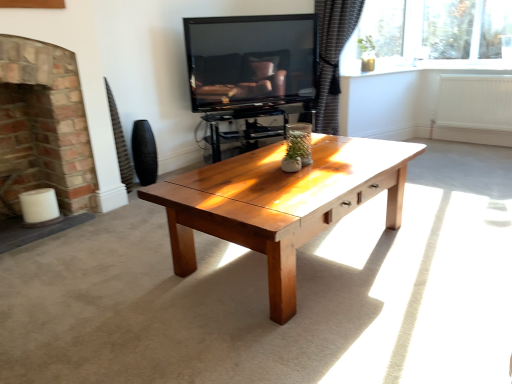
This screenshot has width=512, height=384. Identify the location of matte black tv at upper center. (250, 60).

What is the approximate width of matte black tv at upper center?

8.75 inches.

Measure the distance between point (x=322, y=23) and camera.

A distance of 3.81 meters exists between point (x=322, y=23) and camera.

The image size is (512, 384). What are the coordinates of `white painted radiator at right` in the screenshot? It's located at pos(475,102).

Considering the relative sizes of brick fireplace at left and white painted radiator at right in the image provided, is brick fireplace at left bigger than white painted radiator at right?

Yes.

Is brick fireplace at left aimed at white painted radiator at right?

No, brick fireplace at left does not turn towards white painted radiator at right.

How different are the orientations of brick fireplace at left and white painted radiator at right in degrees?

The facing directions of brick fireplace at left and white painted radiator at right are 89.8 degrees apart.

From the image's perspective, does brick fireplace at left appear lower than white painted radiator at right?

Yes, from the image's perspective, brick fireplace at left is beneath white painted radiator at right.

How many degrees apart are the facing directions of white painted radiator at right and matte black tv at upper center?

59.7 degrees.

Is white painted radiator at right directly adjacent to matte black tv at upper center?

white painted radiator at right is not next to matte black tv at upper center, and they're not touching.

From the image's perspective, is white painted radiator at right on top of matte black tv at upper center?

No.

In terms of height, does white painted radiator at right look taller or shorter compared to matte black tv at upper center?

Considering their sizes, white painted radiator at right has less height than matte black tv at upper center.

From the image's perspective, is white painted radiator at right positioned above or below dark textured curtain at upper right?

Clearly, from the image's perspective, white painted radiator at right is below dark textured curtain at upper right.

Looking at this image, measure the distance from white painted radiator at right to dark textured curtain at upper right.

4.20 feet.

Is white painted radiator at right situated inside dark textured curtain at upper right or outside?

white painted radiator at right exists outside the volume of dark textured curtain at upper right.

Which of these two, white painted radiator at right or dark textured curtain at upper right, stands taller?

dark textured curtain at upper right.

Does black matte vase at left lie in front of white painted radiator at right?

Yes, it is in front of white painted radiator at right.

Consider the image. Does black matte vase at left have a lesser height compared to white painted radiator at right?

Yes, black matte vase at left is shorter than white painted radiator at right.

Who is bigger, black matte vase at left or white painted radiator at right?

white painted radiator at right is bigger.

Is dark textured curtain at upper right positioned in front of matte black tv at upper center?

That is False.

Consider the image. Is dark textured curtain at upper right not near matte black tv at upper center?

No, dark textured curtain at upper right is not far from matte black tv at upper center.

From a real-world perspective, who is located higher, dark textured curtain at upper right or matte black tv at upper center?

From a 3D spatial view, matte black tv at upper center is above.

Between dark textured curtain at upper right and brick fireplace at left, which one appears on the left side from the viewer's perspective?

Positioned to the left is brick fireplace at left.

In the scene shown: Can we say dark textured curtain at upper right lies outside brick fireplace at left?

dark textured curtain at upper right lies outside brick fireplace at left's area.

This screenshot has width=512, height=384. Find the location of `fireplace that is on the left side of dark textured curtain at upper right`. fireplace that is on the left side of dark textured curtain at upper right is located at coordinates (42, 137).

Does dark textured curtain at upper right lie in front of brick fireplace at left?

That is False.

Does point (11, 177) come behind point (202, 36)?

That is False.

From the image's perspective, is brick fireplace at left positioned above or below matte black tv at upper center?

brick fireplace at left is situated lower than matte black tv at upper center in the image.

Is there a large distance between brick fireplace at left and matte black tv at upper center?

Yes, brick fireplace at left is far from matte black tv at upper center.

At what (x,y) coordinates should I click in order to perform the action: click on fireplace located in front of the white painted radiator at right. Please return your answer as a coordinate pair (x, y). Image resolution: width=512 pixels, height=384 pixels. Looking at the image, I should click on (42, 137).

Locate an element on the screen. The height and width of the screenshot is (384, 512). radiator below the matte black tv at upper center (from a real-world perspective) is located at coordinates (475, 102).

From the image, which object appears to be farther from black matte vase at left, dark textured curtain at upper right or white painted radiator at right?

Based on the image, white painted radiator at right appears to be further to black matte vase at left.

When comparing their distances from brick fireplace at left, does dark textured curtain at upper right or matte black tv at upper center seem closer?

matte black tv at upper center lies closer to brick fireplace at left than the other object.

Based on their spatial positions, is brick fireplace at left or black matte vase at left further from matte black tv at upper center?

brick fireplace at left is positioned further to the anchor matte black tv at upper center.

In the scene shown: Estimate the real-world distances between objects in this image. Which object is further from brick fireplace at left, matte black tv at upper center or dark textured curtain at upper right?

dark textured curtain at upper right is further to brick fireplace at left.

Based on their spatial positions, is white painted radiator at right or matte black tv at upper center further from brick fireplace at left?

white painted radiator at right lies further to brick fireplace at left than the other object.

From the image, which object appears to be farther from white painted radiator at right, dark textured curtain at upper right or matte black tv at upper center?

Among the two, matte black tv at upper center is located further to white painted radiator at right.

Based on their spatial positions, is white painted radiator at right or dark textured curtain at upper right closer to black matte vase at left?

dark textured curtain at upper right lies closer to black matte vase at left than the other object.

Looking at the image, which one is located closer to black matte vase at left, white painted radiator at right or brick fireplace at left?

brick fireplace at left is positioned closer to the anchor black matte vase at left.

Where is `vase between brick fireplace at left and white painted radiator at right from left to right`? Image resolution: width=512 pixels, height=384 pixels. vase between brick fireplace at left and white painted radiator at right from left to right is located at coordinates (144, 153).

The width and height of the screenshot is (512, 384). What are the coordinates of `television situated between black matte vase at left and dark textured curtain at upper right from left to right` in the screenshot? It's located at (250, 60).

You are a GUI agent. You are given a task and a screenshot of the screen. Output one action in this format:
    pyautogui.click(x=<x>, y=<y>)
    Task: Click on the vase between brick fireplace at left and dark textured curtain at upper right in the horizontal direction
    Image resolution: width=512 pixels, height=384 pixels.
    Given the screenshot: What is the action you would take?
    pyautogui.click(x=144, y=153)

Identify the location of vase located between brick fireplace at left and matte black tv at upper center in the left-right direction. Image resolution: width=512 pixels, height=384 pixels. (144, 153).